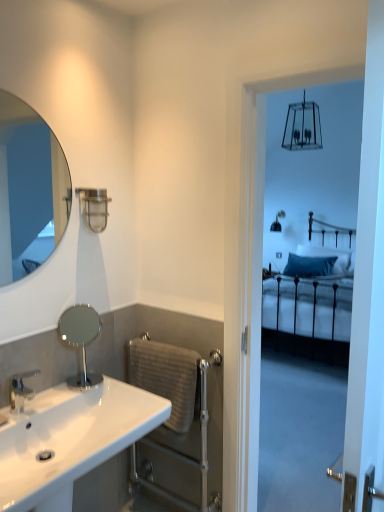
At what (x,y) coordinates should I click in order to perform the action: click on unoccupied area behind silver metallic faucet at lower left. Please return your answer as a coordinate pair (x, y). The width and height of the screenshot is (384, 512). Looking at the image, I should click on (57, 394).